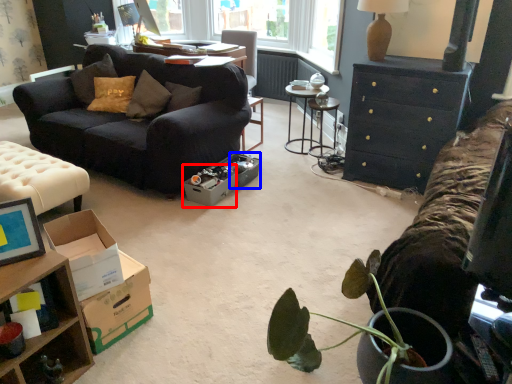
Question: Which object appears closest to the camera in this image, cardboard box (highlighted by a red box) or box (highlighted by a blue box)?

Choices:
 (A) cardboard box
 (B) box

Answer: (A)